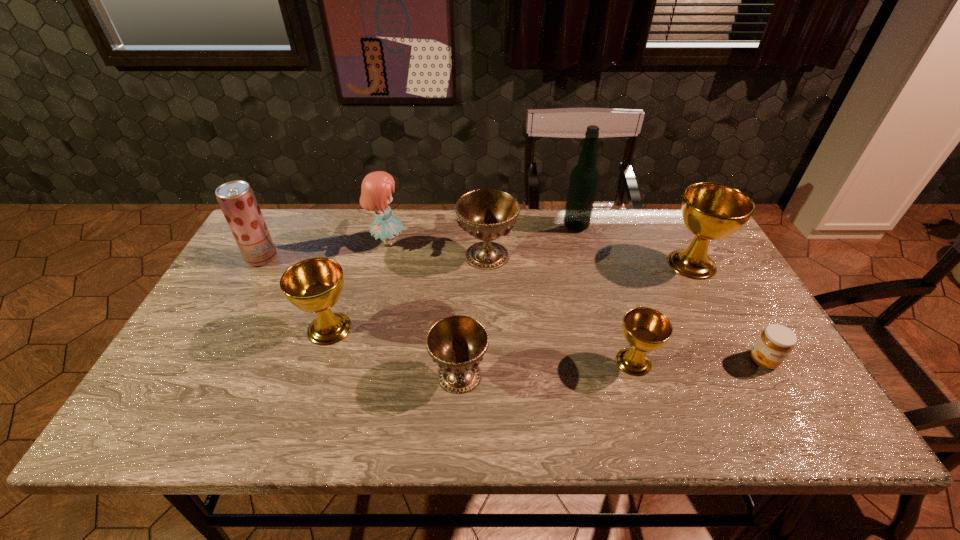
Locate an element on the screen. Image resolution: width=960 pixels, height=540 pixels. jam located in the right edge section of the desktop is located at coordinates (775, 343).

Where is `object that is at the far left corner`? object that is at the far left corner is located at coordinates (236, 199).

Where is `object present at the far right corner`? This screenshot has height=540, width=960. object present at the far right corner is located at coordinates (711, 211).

I want to click on free space at the far edge of the desktop, so click(x=348, y=211).

This screenshot has width=960, height=540. I want to click on vacant region at the near edge of the desktop, so click(262, 415).

Identify the location of vacant region at the left edge of the desktop. pos(233,315).

Locate an element on the screen. This screenshot has height=540, width=960. free space at the near left corner of the desktop is located at coordinates (186, 431).

In the image, there is a desktop. Identify the location of free region at the far right corner. The width and height of the screenshot is (960, 540). (664, 230).

Where is `vacant space at the near right corner`? Image resolution: width=960 pixels, height=540 pixels. vacant space at the near right corner is located at coordinates pyautogui.click(x=791, y=416).

You are a GUI agent. You are given a task and a screenshot of the screen. Output one action in this format:
    pyautogui.click(x=<x>, y=<y>)
    Task: Click on the free space between the blue doll and the leftmost chalice
    Image resolution: width=960 pixels, height=540 pixels.
    Given the screenshot: What is the action you would take?
    pyautogui.click(x=359, y=285)